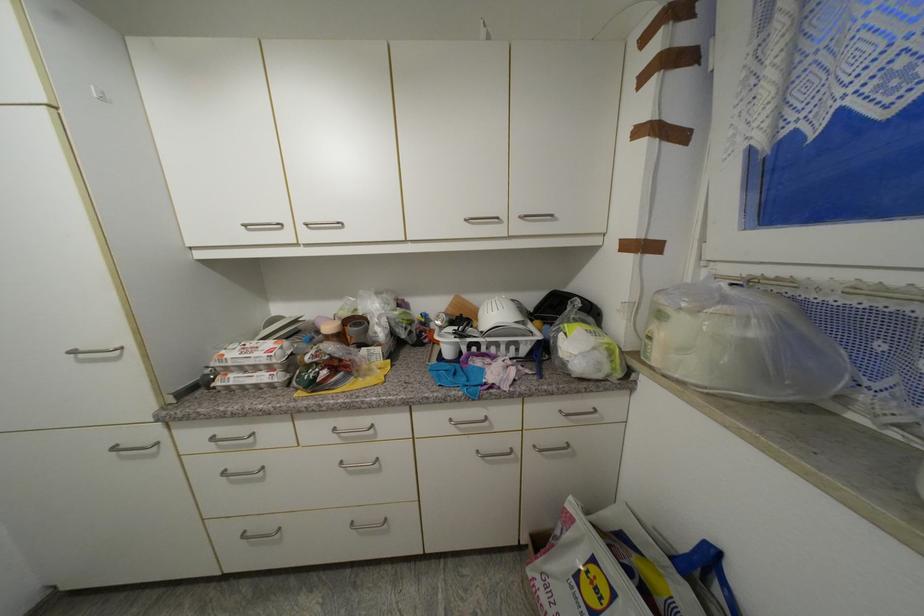
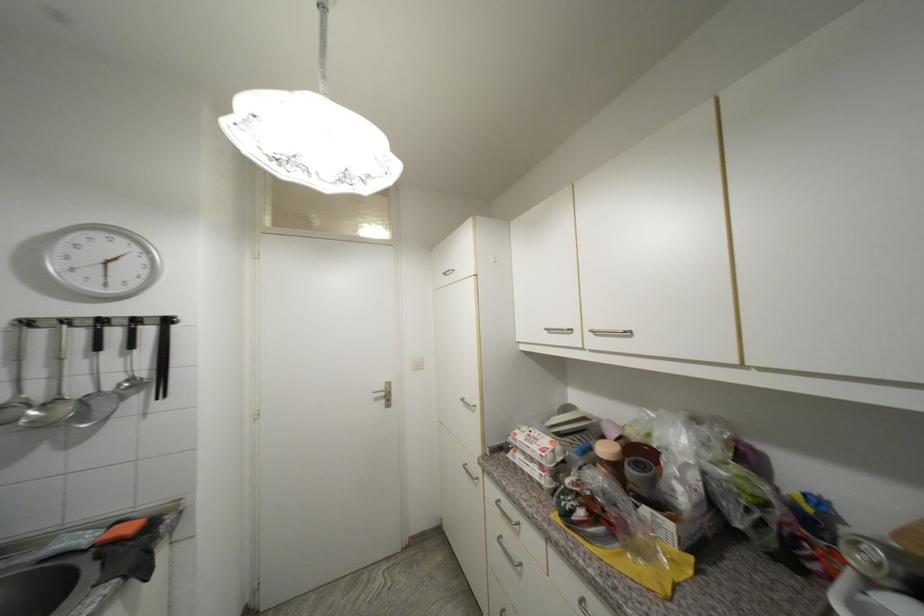
Question: Based on the continuous images, in which direction is the camera rotating? Reply with the corresponding letter.

Choices:
 (A) Left
 (B) Right
 (C) Up
 (D) Down

Answer: (A)